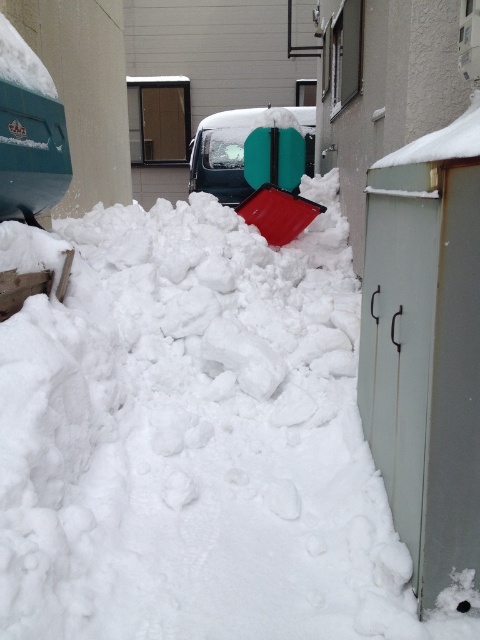
Does white fluffy snow at center come in front of green plastic shovel at center?

Yes, it is.

Who is more forward, (179, 340) or (245, 141)?

Point (179, 340)

At what (x,y) coordinates should I click in order to perform the action: click on white fluffy snow at center. Please return your answer as a coordinate pair (x, y). The width and height of the screenshot is (480, 640). Looking at the image, I should click on (192, 436).

Which is in front, point (4, 410) or point (303, 112)?

Point (4, 410)

Locate an element on the screen. The image size is (480, 640). white fluffy snow at center is located at coordinates (192, 436).

Is point (171, 468) in front of point (236, 195)?

Yes, point (171, 468) is closer to viewer.

This screenshot has width=480, height=640. Identify the location of white fluffy snow at center. (192, 436).

Who is shorter, green plastic shovel at center or green matte van at center?

With less height is green plastic shovel at center.

What do you see at coordinates (276, 177) in the screenshot? This screenshot has height=640, width=480. I see `green plastic shovel at center` at bounding box center [276, 177].

What do you see at coordinates (276, 177) in the screenshot? I see `green plastic shovel at center` at bounding box center [276, 177].

Identify the location of green plastic shovel at center. (276, 177).